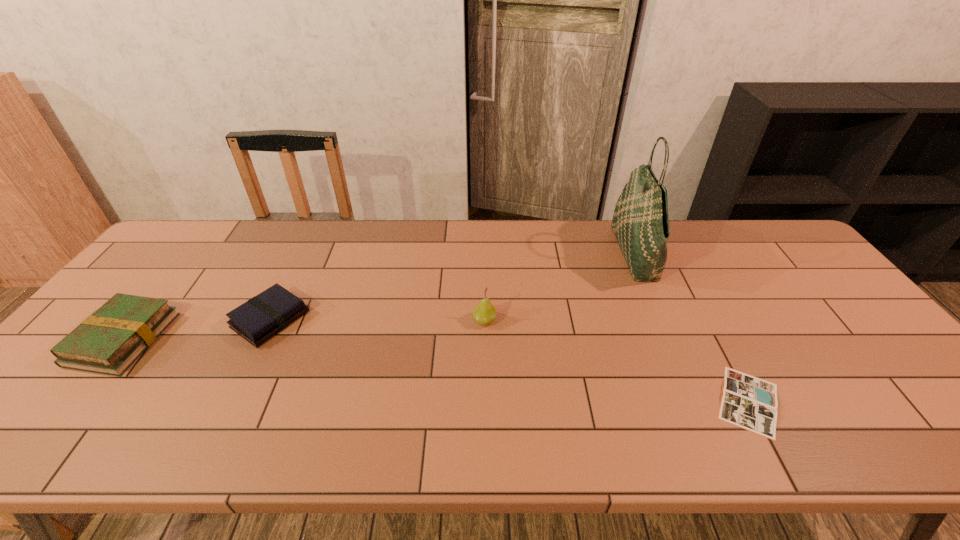
Where is `vacant space located on the right of the farthest object`? The height and width of the screenshot is (540, 960). vacant space located on the right of the farthest object is located at coordinates (770, 254).

Identify the location of vacant space positioned 0.260m on the left of the second tallest object. This screenshot has height=540, width=960. (376, 320).

The width and height of the screenshot is (960, 540). Find the location of `free space located 0.300m on the right of the leftmost object`. free space located 0.300m on the right of the leftmost object is located at coordinates (278, 339).

At what (x,y) coordinates should I click in order to perform the action: click on vacant space located 0.250m on the front of the second book from right to left. Please return your answer as a coordinate pair (x, y). This screenshot has height=540, width=960. Looking at the image, I should click on (210, 442).

In order to click on free space located 0.210m on the back of the shortest book in this screenshot , I will do `click(698, 306)`.

The width and height of the screenshot is (960, 540). I want to click on object that is at the far edge, so click(640, 222).

The image size is (960, 540). In order to click on object that is at the near edge in this screenshot , I will do click(x=748, y=402).

Where is `object that is at the left edge`? The width and height of the screenshot is (960, 540). object that is at the left edge is located at coordinates (109, 341).

I want to click on vacant region at the far edge, so click(537, 241).

In the image, there is a desktop. At what (x,y) coordinates should I click in order to perform the action: click on vacant region at the near edge. Please return your answer as a coordinate pair (x, y). This screenshot has width=960, height=540. Looking at the image, I should click on (555, 426).